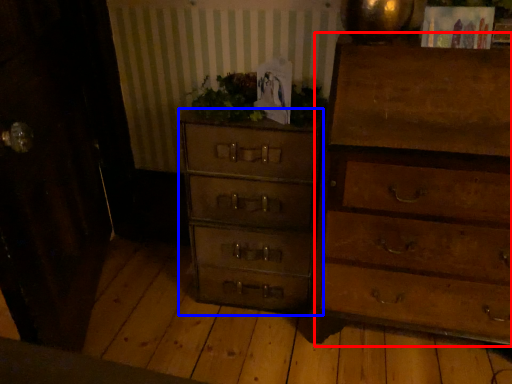
Question: Among these objects, which one is nearest to the camera, chest of drawers (highlighted by a red box) or chest of drawers (highlighted by a blue box)?

Choices:
 (A) chest of drawers
 (B) chest of drawers

Answer: (A)